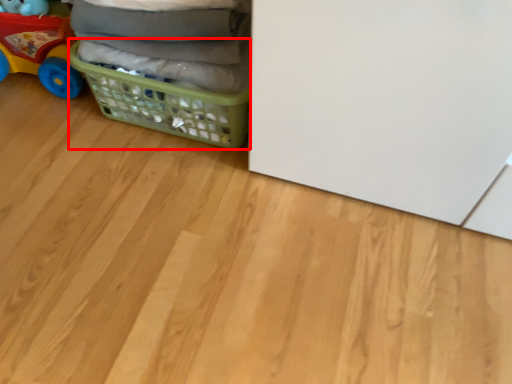
Question: From the image's perspective, where is basket (annotated by the red box) located in relation to toy in the image?

Choices:
 (A) above
 (B) below

Answer: (B)